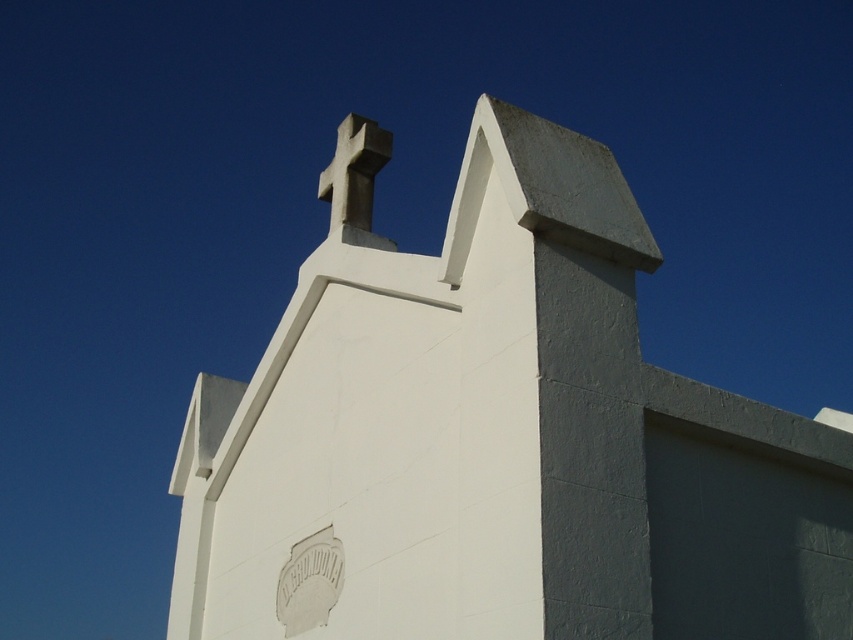
The height and width of the screenshot is (640, 853). I want to click on white smooth stone church at center, so click(x=500, y=442).

Does white smooth stone church at center appear on the left side of white stone cross at upper center?

In fact, white smooth stone church at center is to the right of white stone cross at upper center.

Between point (252, 573) and point (357, 129), which one is positioned in front?

Point (252, 573) is more forward.

At what (x,y) coordinates should I click in order to perform the action: click on white smooth stone church at center. Please return your answer as a coordinate pair (x, y). Looking at the image, I should click on point(500,442).